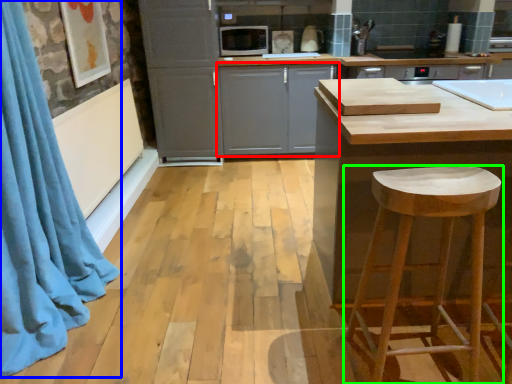
Question: Which is farther away from cabinetry (highlighted by a red box)? shower curtain (highlighted by a blue box) or stool (highlighted by a green box)?

Choices:
 (A) shower curtain
 (B) stool

Answer: (B)